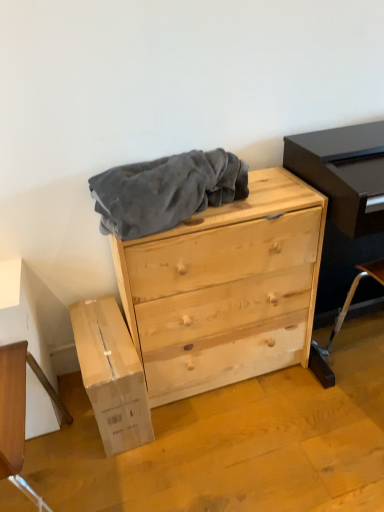
You are a GUI agent. You are given a task and a screenshot of the screen. Output one action in this format:
    pyautogui.click(x=<x>, y=<y>)
    Task: Click on the free space that is in between natural wood chest of drawers at center and white cardboard box at lower left
    The width and height of the screenshot is (384, 512).
    Given the screenshot: What is the action you would take?
    pyautogui.click(x=207, y=416)